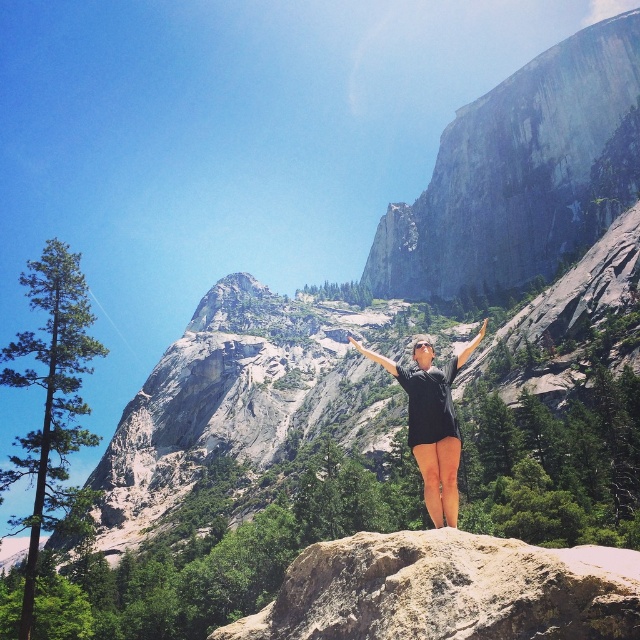
You are a photographer trying to capture the scene with a wide angle lens. You notice the black fabric arm at center and the matte black hand at upper center. Which object should you focus on first to ensure both are in sharp focus?

You should focus on the matte black hand at upper center first because it is further away than the black fabric arm at center, ensuring both will be in focus when using a wide angle lens.